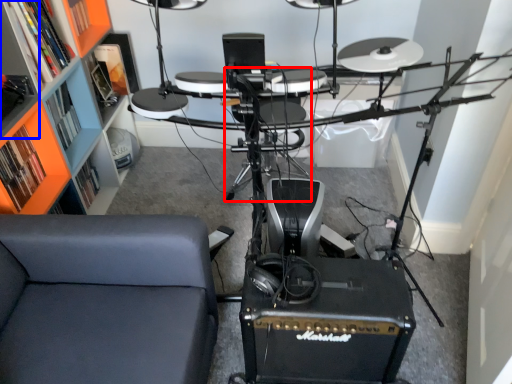
Question: Among these objects, which one is nearest to the camera, armchair (highlighted by a red box) or shelf (highlighted by a blue box)?

Choices:
 (A) armchair
 (B) shelf

Answer: (B)